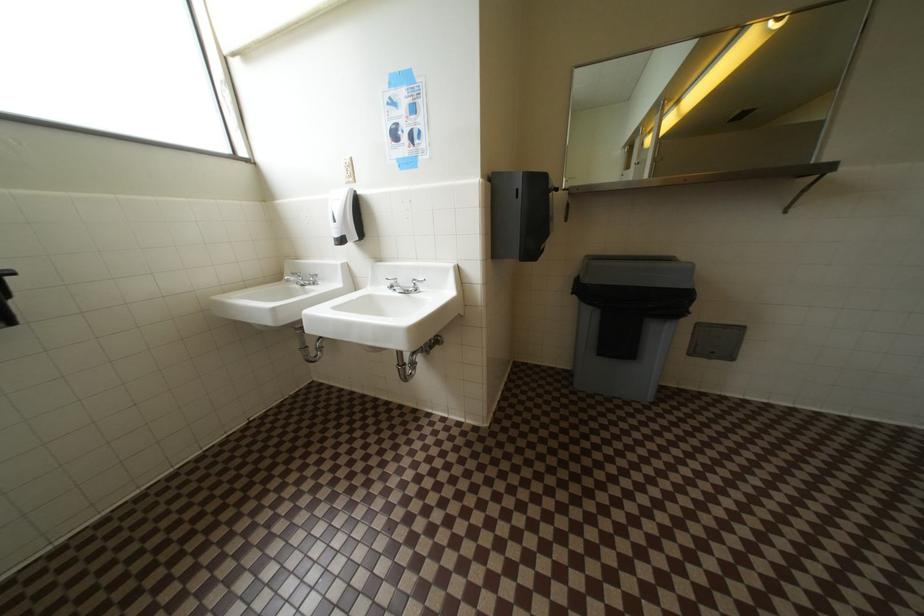
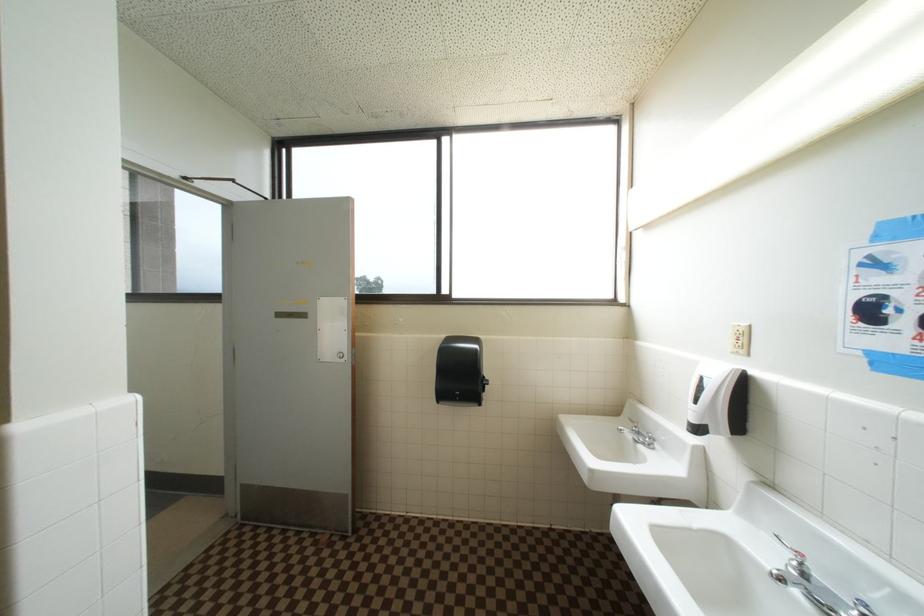
Question: The first image is from the beginning of the video and the second image is from the end. How did the camera likely rotate when shooting the video?

Choices:
 (A) Left
 (B) Right
 (C) Up
 (D) Down

Answer: (A)